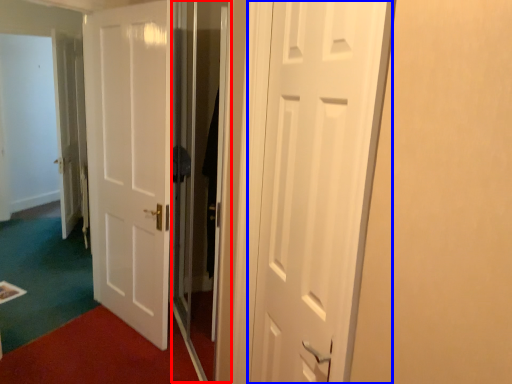
Question: Which point is further to the camera, screen door (highlighted by a red box) or door (highlighted by a blue box)?

Choices:
 (A) screen door
 (B) door

Answer: (A)